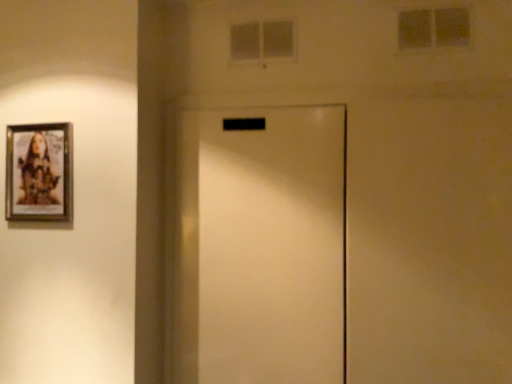
This screenshot has height=384, width=512. Describe the element at coordinates (39, 172) in the screenshot. I see `wooden-framed photo at left` at that location.

I want to click on wooden-framed photo at left, so click(x=39, y=172).

Identify the location of wooden-framed photo at left. Image resolution: width=512 pixels, height=384 pixels. (39, 172).